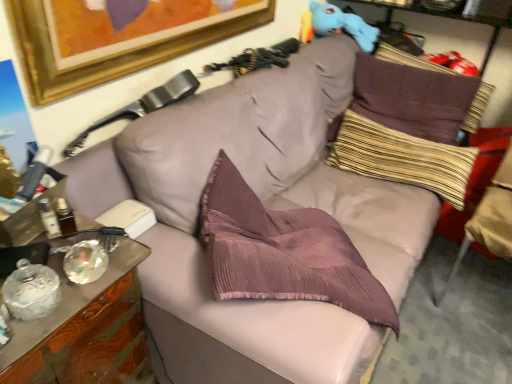
Question: Is beige fabric swivel chair at right, the 1th swivel chair positioned from the right, wider or thinner than wooden cabinet at left?

Choices:
 (A) wide
 (B) thin

Answer: (A)

Question: In the image, is beige fabric swivel chair at right, placed as the second swivel chair when sorted from left to right, on the left side or the right side of wooden cabinet at left?

Choices:
 (A) left
 (B) right

Answer: (B)

Question: Estimate the real-world distances between objects in this image. Which object is farther from the leather at upper left, acting as the first swivel chair starting from the left?

Choices:
 (A) wooden cabinet at left
 (B) blue plush toy at upper right
 (C) beige fabric swivel chair at right, placed as the second swivel chair when sorted from left to right
 (D) purple corduroy pillow at upper right, which is the second pillow from bottom to top
 (E) striped fabric pillow at upper right, which is counted as the 1th pillow, starting from the bottom

Answer: (D)

Question: Which of these objects is positioned closest to the blue plush toy at upper right?

Choices:
 (A) wooden cabinet at left
 (B) purple corduroy pillow at upper right, placed as the first pillow when sorted from top to bottom
 (C) striped fabric pillow at upper right, the second pillow viewed from the top
 (D) beige fabric swivel chair at right, placed as the second swivel chair when sorted from left to right
 (E) leather at upper left, acting as the first swivel chair starting from the left

Answer: (B)